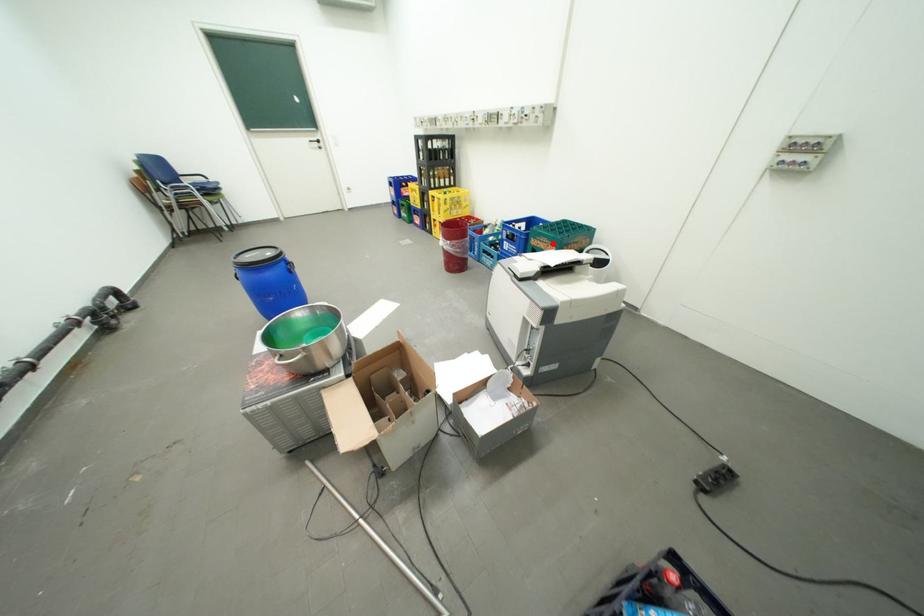
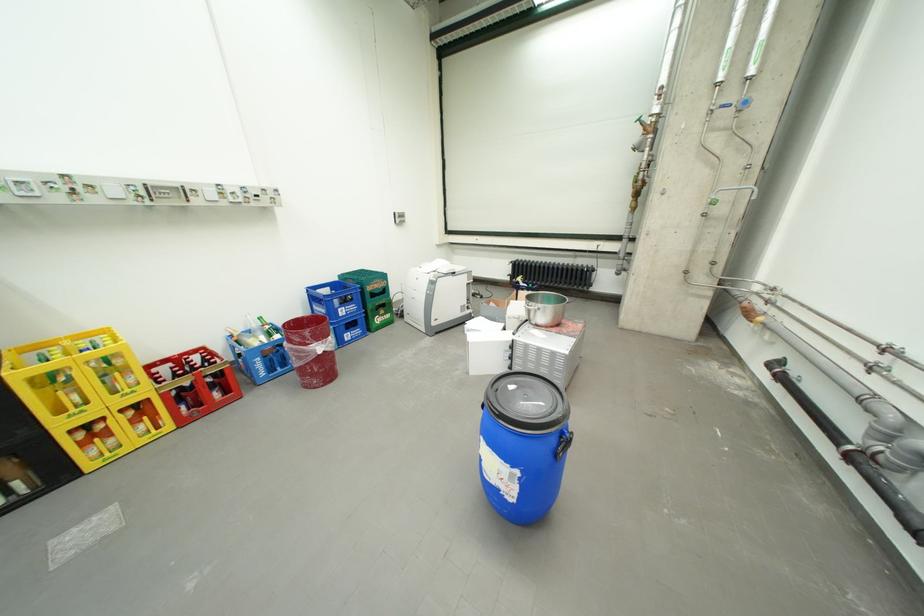
Question: I am providing you with two images of the same scene from different viewpoints. In image1, a red point is highlighted. Considering the same 3D point in image2, which of the following is correct?

Choices:
 (A) It is closer
 (B) It is farther

Answer: (A)